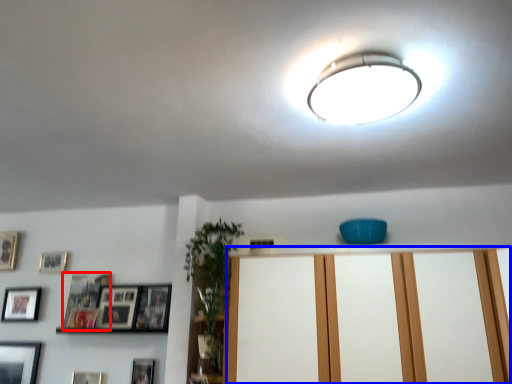
Question: Which of the following is the closest to the observer, picture frame (highlighted by a red box) or dresser (highlighted by a blue box)?

Choices:
 (A) picture frame
 (B) dresser

Answer: (B)